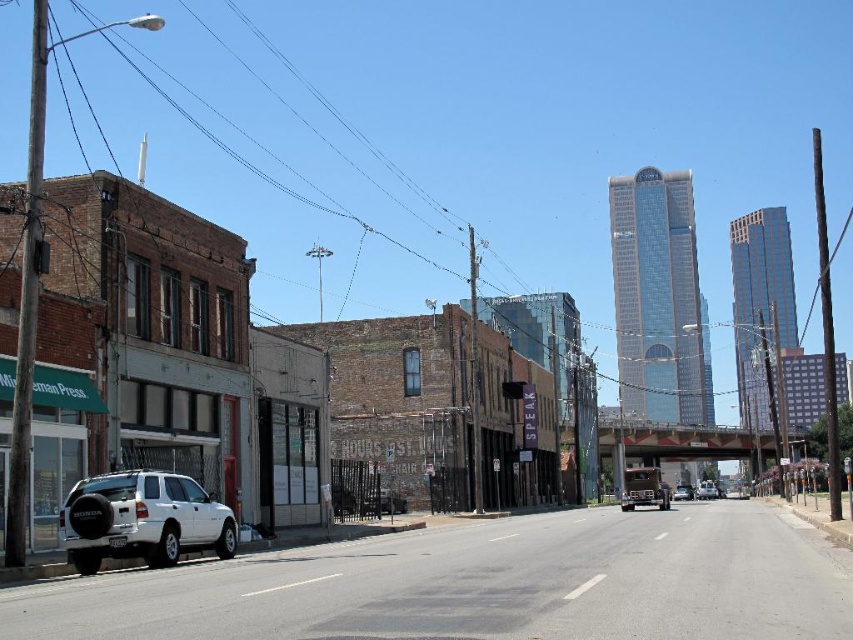
Consider the image. Is the position of white matte truck at center less distant than that of metallic silver sedan at center?

That is False.

Is white matte truck at center smaller than metallic silver sedan at center?

Actually, white matte truck at center might be larger than metallic silver sedan at center.

Who is more distant from viewer, (706, 497) or (691, 486)?

Point (691, 486)

Locate an element on the screen. white matte truck at center is located at coordinates (706, 490).

Does white matte suv at lower left have a greater height compared to metallic silver sedan at center?

No, white matte suv at lower left is not taller than metallic silver sedan at center.

In the scene shown: Can you confirm if white matte suv at lower left is positioned to the left of metallic silver sedan at center?

Indeed, white matte suv at lower left is positioned on the left side of metallic silver sedan at center.

The width and height of the screenshot is (853, 640). In order to click on white matte suv at lower left in this screenshot , I will do `click(142, 518)`.

Between point (128, 522) and point (712, 484), which one is positioned in front?

Point (128, 522) is in front.

Based on the photo, is white matte suv at lower left to the right of white matte truck at center from the viewer's perspective?

In fact, white matte suv at lower left is to the left of white matte truck at center.

Who is more distant from viewer, (115, 532) or (700, 484)?

Point (700, 484)

Where is `white matte suv at lower left`? This screenshot has height=640, width=853. white matte suv at lower left is located at coordinates (142, 518).